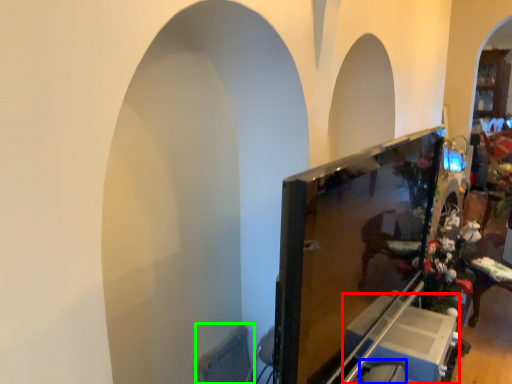
Question: Which object is positioned farthest from furniture (highlighted by a red box)? Select from swivel chair (highlighted by a blue box) and swivel chair (highlighted by a green box).

Choices:
 (A) swivel chair
 (B) swivel chair

Answer: (B)